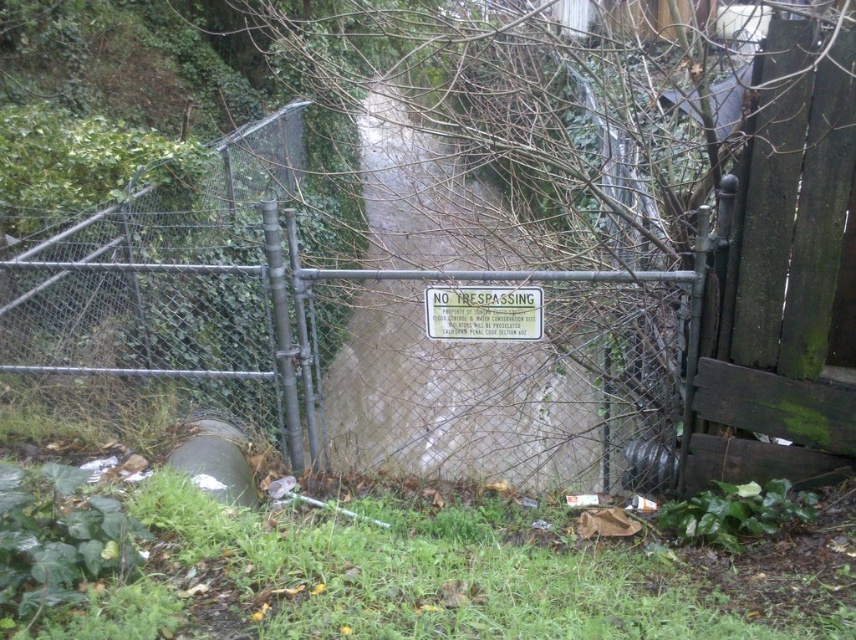
Question: Does green mossy wood door at right appear on the left side of metallic silver sign at center?

Choices:
 (A) no
 (B) yes

Answer: (A)

Question: Is green grass at lower center thinner than metallic silver sign at center?

Choices:
 (A) no
 (B) yes

Answer: (A)

Question: Which point is closer to the camera?

Choices:
 (A) (791, 152)
 (B) (852, 630)

Answer: (B)

Question: Among these objects, which one is farthest from the camera?

Choices:
 (A) green grass at lower center
 (B) green mossy wood door at right
 (C) metallic silver sign at center

Answer: (C)

Question: Among these objects, which one is farthest from the camera?

Choices:
 (A) green grass at lower center
 (B) green mossy wood door at right

Answer: (B)

Question: Does metal chain-link fence at center appear on the right side of metallic silver sign at center?

Choices:
 (A) no
 (B) yes

Answer: (B)